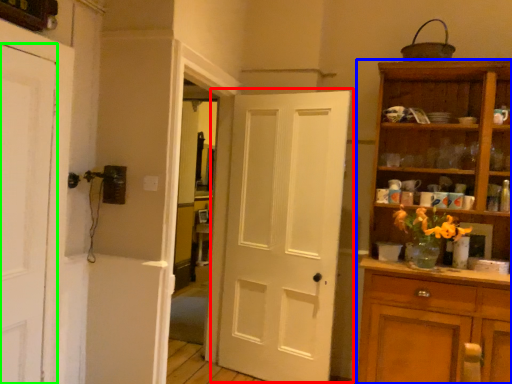
Question: Considering the real-world distances, which object is farthest from door (highlighted by a red box)? cupboard (highlighted by a blue box) or door (highlighted by a green box)?

Choices:
 (A) cupboard
 (B) door

Answer: (B)